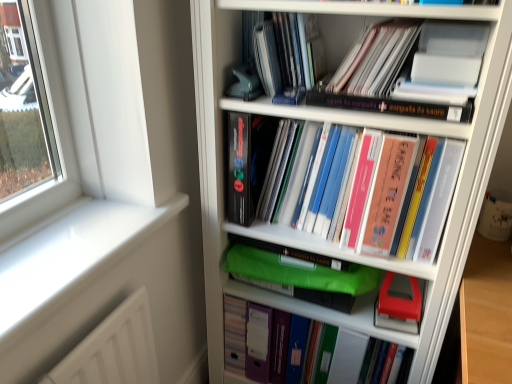
This screenshot has width=512, height=384. I want to click on free space above white glossy window sill at left (from a real-world perspective), so click(x=77, y=235).